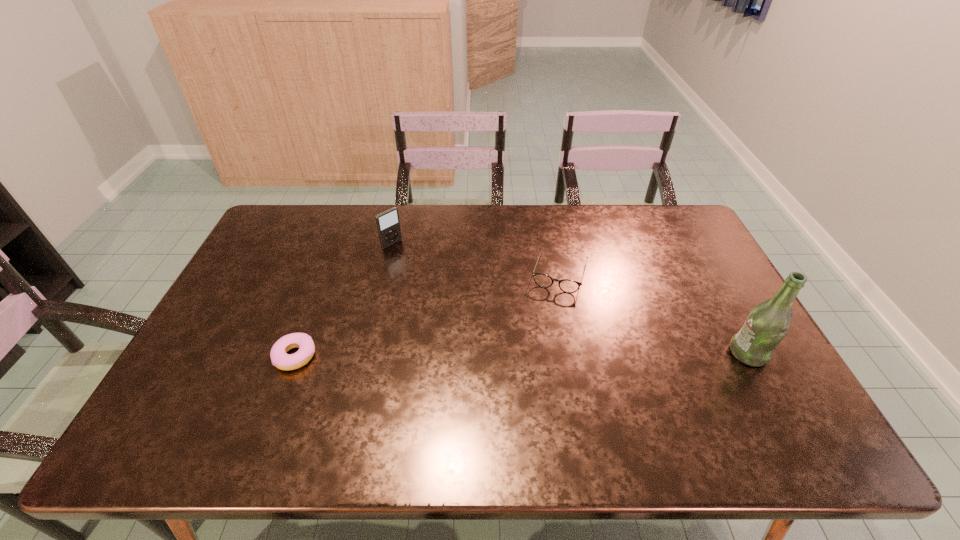
You are a GUI agent. You are given a task and a screenshot of the screen. Output one action in this format:
    pyautogui.click(x=<x>, y=<y>)
    Task: Click on the free space on the desktop that is between the shortest object and the tallest object and is positioned on the front-facing side of the farthest object
    Image resolution: width=960 pixels, height=540 pixels.
    Given the screenshot: What is the action you would take?
    pyautogui.click(x=530, y=354)

Find the location of a particular element. vacant spot on the desktop that is between the leftmost object and the tallest object and is positioned through the lenses of the second farthest object is located at coordinates pyautogui.click(x=536, y=354).